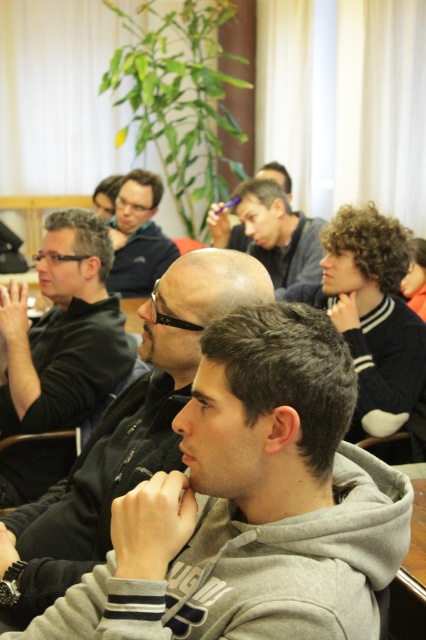
Does gray hoodie at center have a smaller size compared to matte black hair at center?

Incorrect, gray hoodie at center is not smaller in size than matte black hair at center.

Does gray hoodie at center appear on the right side of matte black hair at center?

In fact, gray hoodie at center is to the left of matte black hair at center.

This screenshot has height=640, width=426. What do you see at coordinates (123, 435) in the screenshot? I see `gray hoodie at center` at bounding box center [123, 435].

You are a GUI agent. You are given a task and a screenshot of the screen. Output one action in this format:
    pyautogui.click(x=<x>, y=<y>)
    Task: Click on the gray hoodie at center
    This screenshot has height=640, width=426.
    Given the screenshot: What is the action you would take?
    pyautogui.click(x=123, y=435)

Between matte black jacket at left and matte black jacket at upper center, which one appears on the right side from the viewer's perspective?

matte black jacket at upper center is more to the right.

Consider the image. Between matte black jacket at left and matte black jacket at upper center, which one is positioned lower?

matte black jacket at left is lower down.

Is point (77, 371) behind point (138, 195)?

No, (77, 371) is closer to viewer.

At what (x,y) coordinates should I click in order to perform the action: click on matte black jacket at left. Please return your answer as a coordinate pair (x, y). Looking at the image, I should click on (63, 332).

Who is higher up, gray hoodie at center or matte black jacket at upper center?

Positioned higher is matte black jacket at upper center.

Between point (23, 579) and point (138, 180), which one is positioned behind?

The point (138, 180) is more distant.

This screenshot has height=640, width=426. In order to click on gray hoodie at center in this screenshot , I will do `click(123, 435)`.

Locate an element on the screen. The image size is (426, 640). gray hoodie at center is located at coordinates (123, 435).